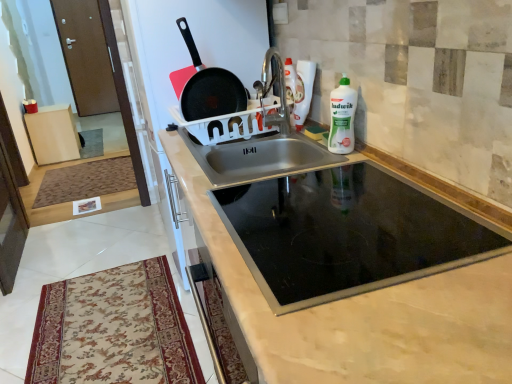
This screenshot has height=384, width=512. Identify the location of free point below beige floral rug at lower left, placed as the first mat when sorted from bottom to top (from a real-world perspective). (109, 329).